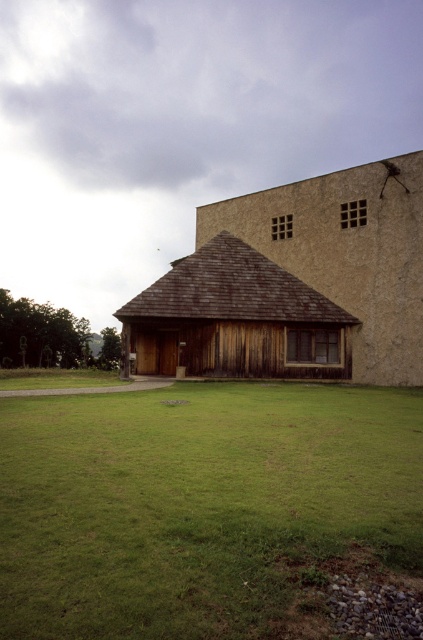
Question: Which point appears farthest from the camera in this image?

Choices:
 (A) (261, 493)
 (B) (208, 308)

Answer: (B)

Question: Which object appears closest to the camera in this image?

Choices:
 (A) green grass at center
 (B) weathered wood hut at center

Answer: (A)

Question: Can you confirm if green grass at center is smaller than weathered wood hut at center?

Choices:
 (A) yes
 (B) no

Answer: (A)

Question: Where is green grass at center located in relation to weathered wood hut at center in the image?

Choices:
 (A) below
 (B) above

Answer: (A)

Question: Which of the following is the closest to the observer?

Choices:
 (A) (98, 440)
 (B) (137, 362)

Answer: (A)

Question: Can you confirm if green grass at center is thinner than weathered wood hut at center?

Choices:
 (A) no
 (B) yes

Answer: (B)